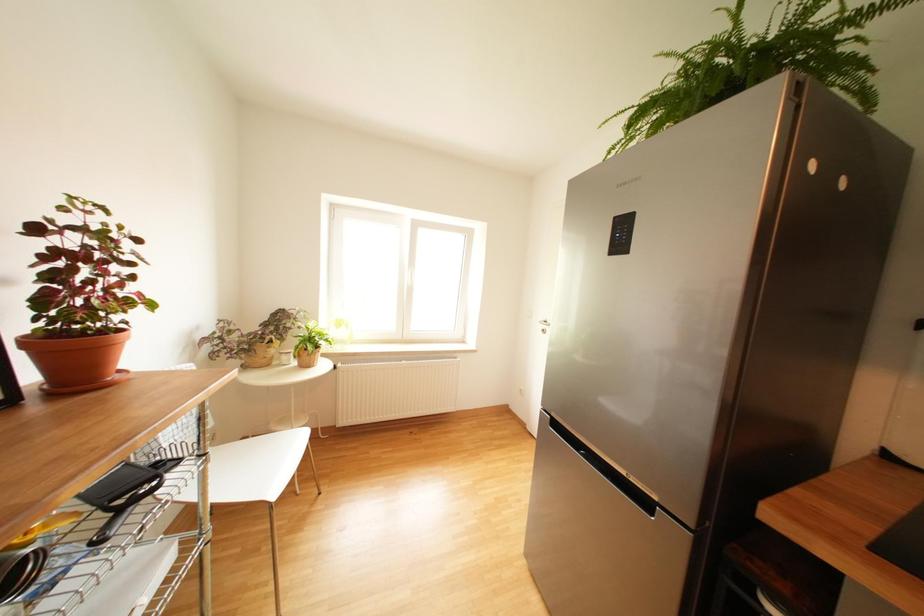
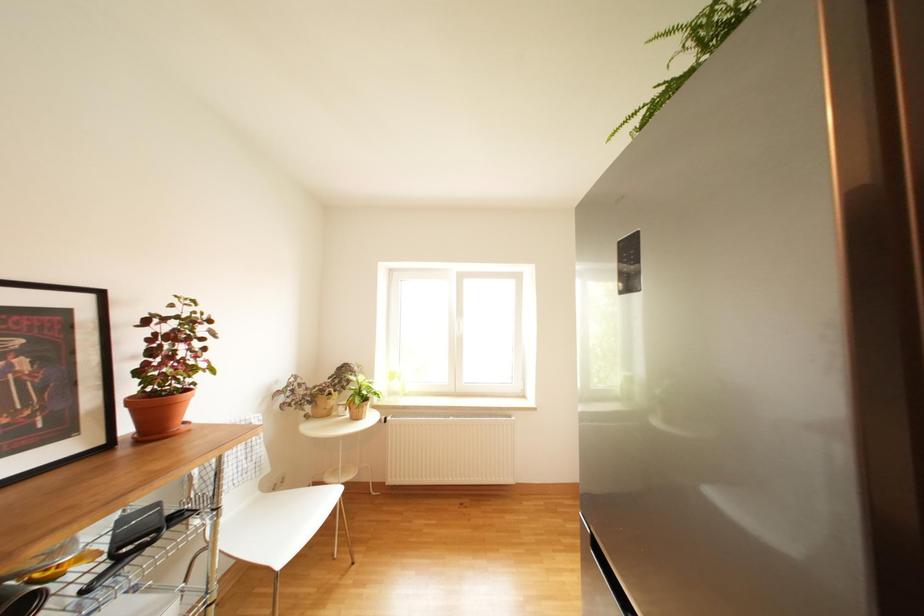
Question: The first image is from the beginning of the video and the second image is from the end. How did the camera likely rotate when shooting the video?

Choices:
 (A) Left
 (B) Right
 (C) Up
 (D) Down

Answer: (A)